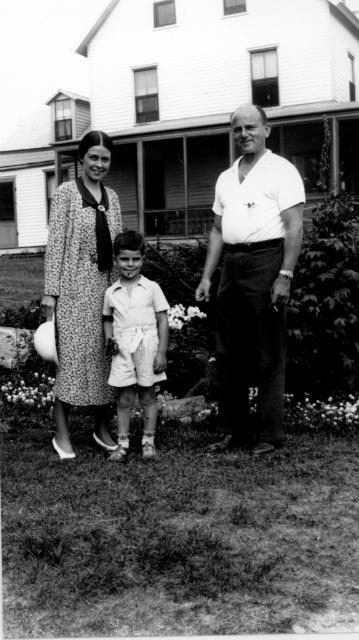
You are trying to determine the clothing details of the family members in the photo. Based on the image, which clothing item is wider between the dress fabric woman at center and the smooth white shorts at center?

The dress fabric woman at center is wider than the smooth white shorts at center according to the description.

You are a photographer who wants to take a picture of the dotted fabric dress at center and the smooth white shorts at center. Which one is positioned to the left?

The dotted fabric dress at center is to the left of the smooth white shorts at center, so the dotted fabric dress at center is positioned to the left.